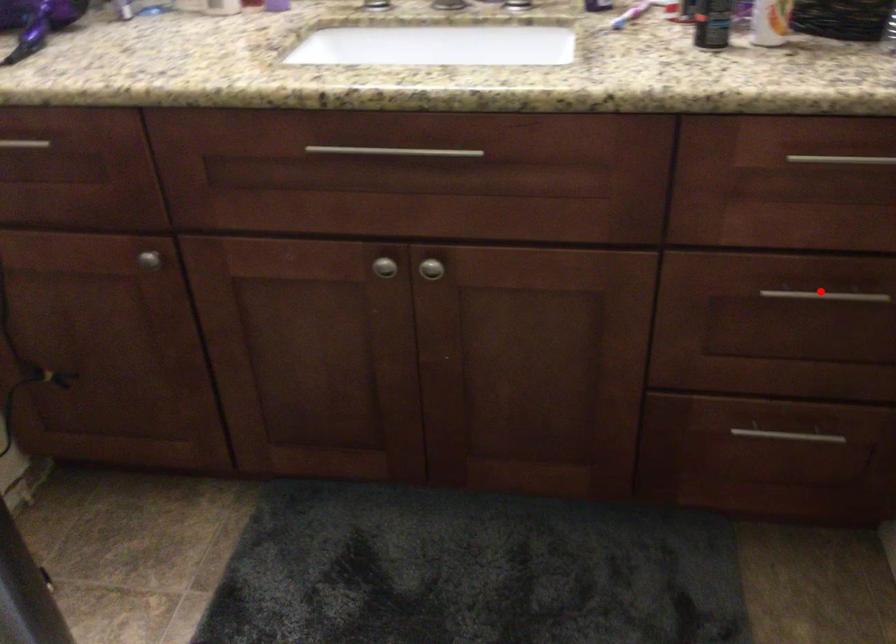
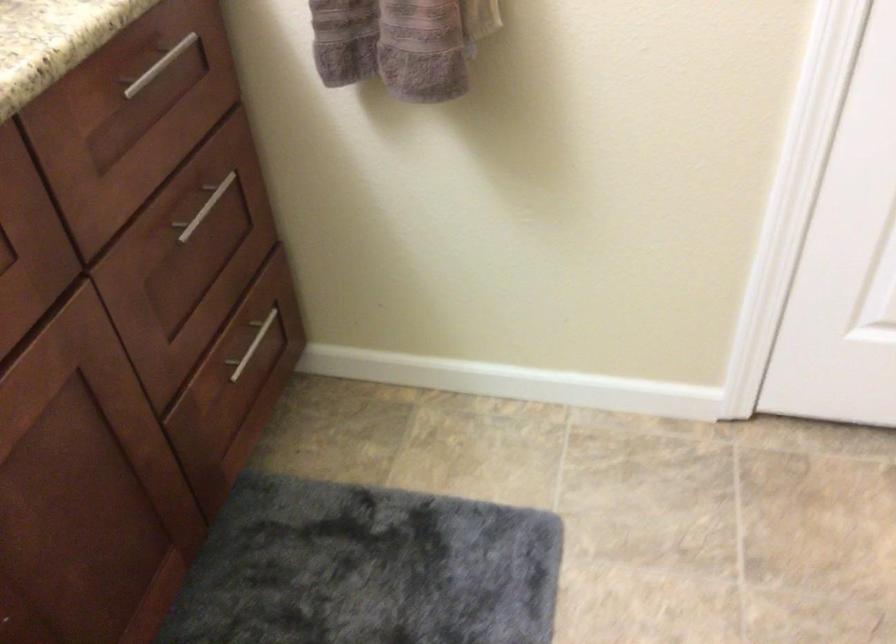
Find the pixel in the second image that matches the highlighted location in the first image.

(203, 207)